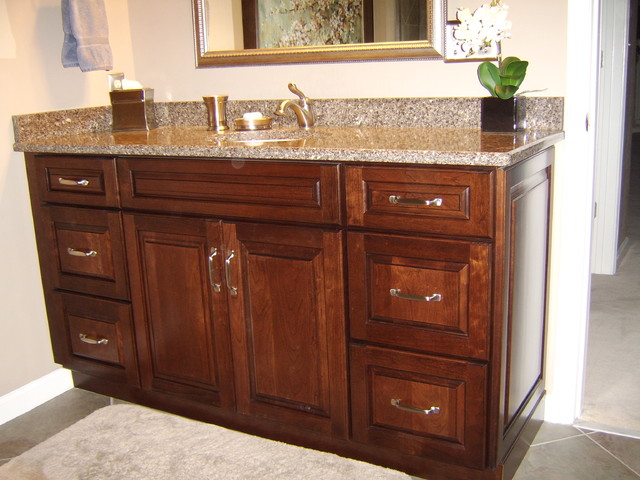
The height and width of the screenshot is (480, 640). What are the coordinates of `reflection of a painting` in the screenshot? It's located at (268, 12).